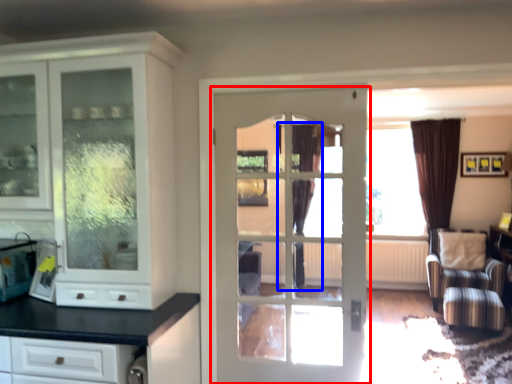
Question: Which object is further to the camera taking this photo, door (highlighted by a red box) or curtain (highlighted by a blue box)?

Choices:
 (A) door
 (B) curtain

Answer: (B)